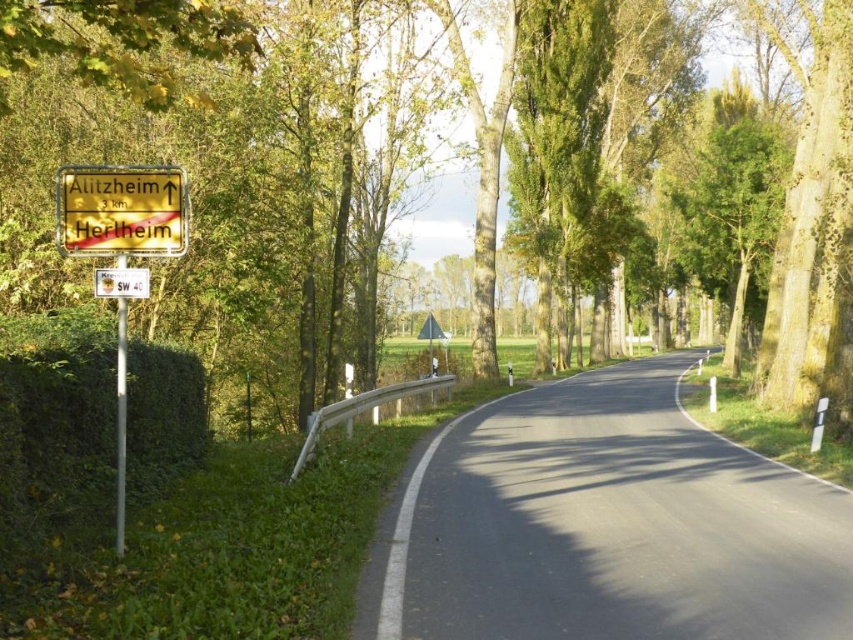
Question: Can you confirm if green leafy tree at left is positioned below green leafy hedge at left?

Choices:
 (A) no
 (B) yes

Answer: (A)

Question: Does green leafy hedge at left appear on the left side of yellow wooden sign at left?

Choices:
 (A) no
 (B) yes

Answer: (B)

Question: Which point is closer to the camera taking this photo?

Choices:
 (A) (99, 284)
 (B) (158, 177)
 (C) (784, 346)

Answer: (A)

Question: Which object is farther from the camera taking this photo?

Choices:
 (A) yellow wooden sign at left
 (B) yellow plastic sign at upper left
 (C) green leafy hedge at left

Answer: (B)

Question: Among these objects, which one is farthest from the camera?

Choices:
 (A) green leafy hedge at left
 (B) green leafy tree at left
 (C) yellow metallic sign at left

Answer: (C)

Question: Does yellow wooden sign at left come in front of yellow plastic sign at upper left?

Choices:
 (A) yes
 (B) no

Answer: (A)